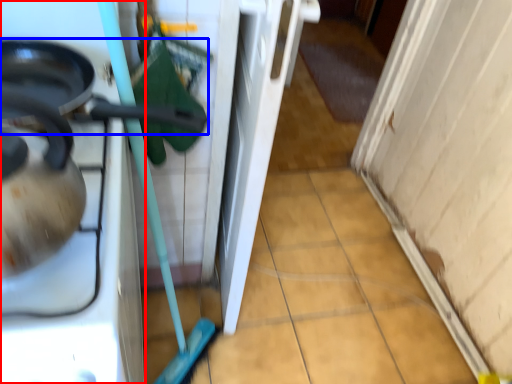
Question: Which point is further to the camera, home appliance (highlighted by a red box) or frying pan (highlighted by a blue box)?

Choices:
 (A) home appliance
 (B) frying pan

Answer: (B)